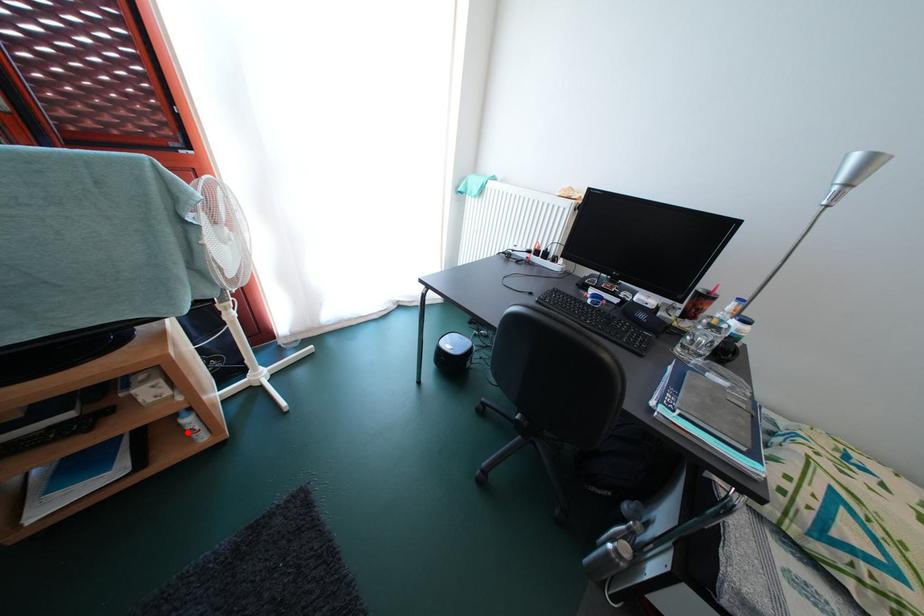
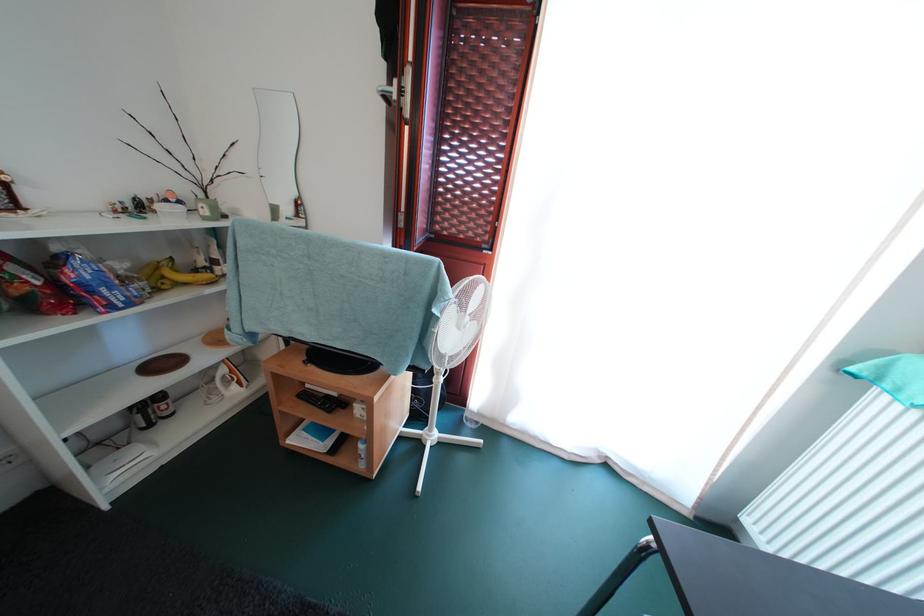
Locate, in the second image, the point that corresponds to the highlighted location in the first image.

(363, 453)